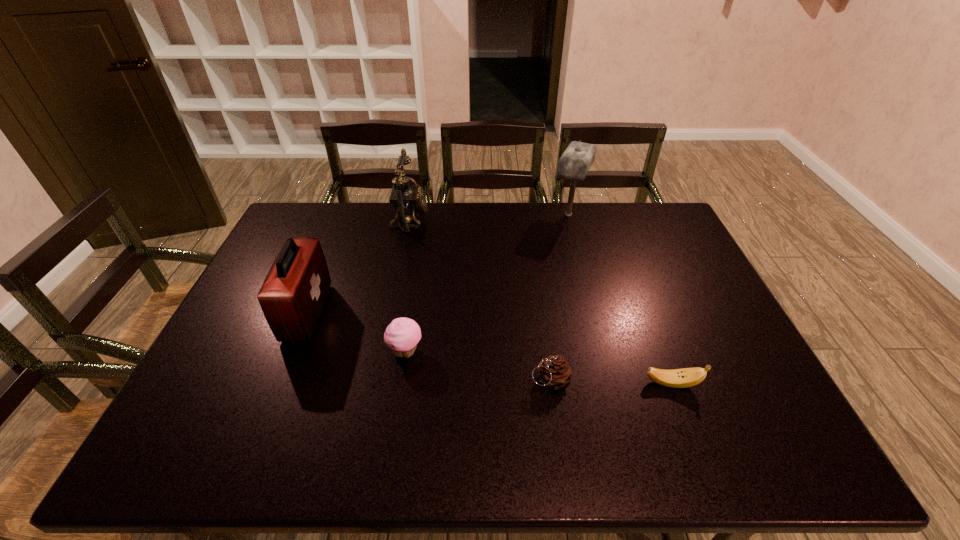
I want to click on free space that is in between the cupcake and the telephone, so click(408, 285).

Find the location of a particular element. The width and height of the screenshot is (960, 540). unoccupied area between the telephone and the leftmost object is located at coordinates (359, 266).

The height and width of the screenshot is (540, 960). In order to click on free point between the first aid kit and the cupcake in this screenshot , I will do `click(356, 332)`.

Where is `unoccupied position between the mallet and the telephone`? unoccupied position between the mallet and the telephone is located at coordinates (490, 217).

Where is `vacant area that lies between the fourth object from left to right and the telephone`? vacant area that lies between the fourth object from left to right and the telephone is located at coordinates (480, 299).

Identify which object is located as the fifth nearest to the leftmost object. Please provide its 2D coordinates. Your answer should be formatted as a tuple, i.e. [(x, y)], where the tuple contains the x and y coordinates of a point satisfying the conditions above.

[(678, 378)]

Where is `object that is the fifth closest to the cupcake`? object that is the fifth closest to the cupcake is located at coordinates (574, 164).

Where is `free spot that satisfies the following two spatial constraints: 1. on the back side of the banana; 2. on the side of the first aid kit with the cross symbol`? The height and width of the screenshot is (540, 960). free spot that satisfies the following two spatial constraints: 1. on the back side of the banana; 2. on the side of the first aid kit with the cross symbol is located at coordinates (645, 313).

I want to click on free space in the image that satisfies the following two spatial constraints: 1. on the side of the leftmost object with the cross symbol; 2. on the right side of the rightmost object, so coord(279,383).

Where is `free region that satisfies the following two spatial constraints: 1. on the back side of the cupcake; 2. on the left side of the fifth object from left to right`? Image resolution: width=960 pixels, height=540 pixels. free region that satisfies the following two spatial constraints: 1. on the back side of the cupcake; 2. on the left side of the fifth object from left to right is located at coordinates (427, 214).